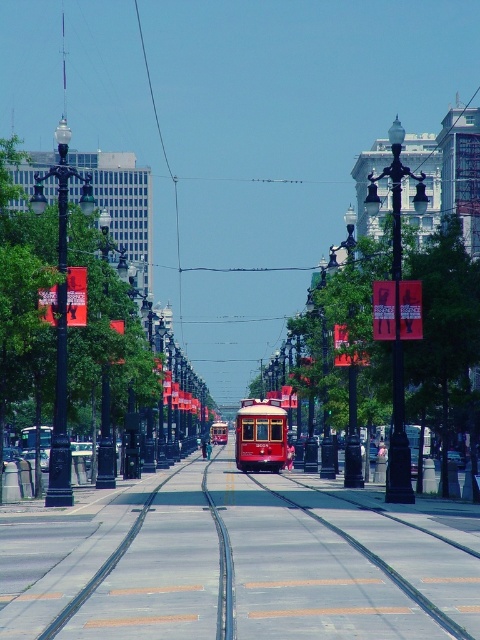
Consider the image. You are a pedestrian standing on the sidewalk and see the metallic track at center and the polished wood tram at center. Which object is closer to the left side of the avenue?

The metallic track at center is closer to the left side of the avenue because it is positioned to the left of the polished wood tram at center.

You are standing on the sidewalk observing the red trolley car in the scene. There are two points marked in the image. Which point, point 1 at coordinates (428, 560) or point 2 at coordinates (276, 458), is closer to you?

Point 1 at coordinates (428, 560) is closer to you than point 2 at coordinates (276, 458).